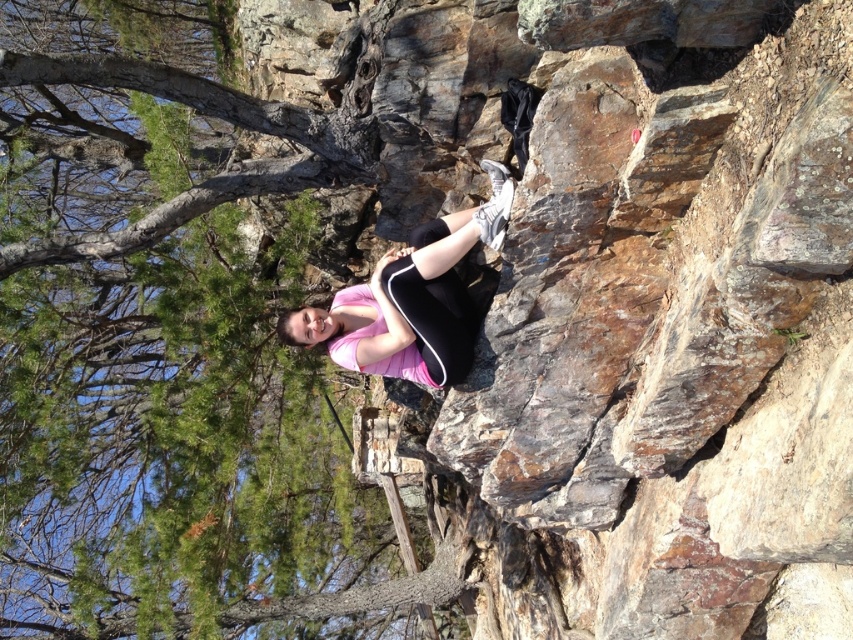
Question: Which of the following is the closest to the observer?

Choices:
 (A) pink matte leggings at center
 (B) rusty stone cliff at center

Answer: (B)

Question: Does rusty stone cliff at center lie in front of pink matte leggings at center?

Choices:
 (A) yes
 (B) no

Answer: (A)

Question: Is rusty stone cliff at center to the left of pink matte leggings at center from the viewer's perspective?

Choices:
 (A) yes
 (B) no

Answer: (A)

Question: Does rusty stone cliff at center appear over pink matte leggings at center?

Choices:
 (A) yes
 (B) no

Answer: (B)

Question: Which point is farther to the camera?

Choices:
 (A) pink matte leggings at center
 (B) rusty stone cliff at center

Answer: (A)